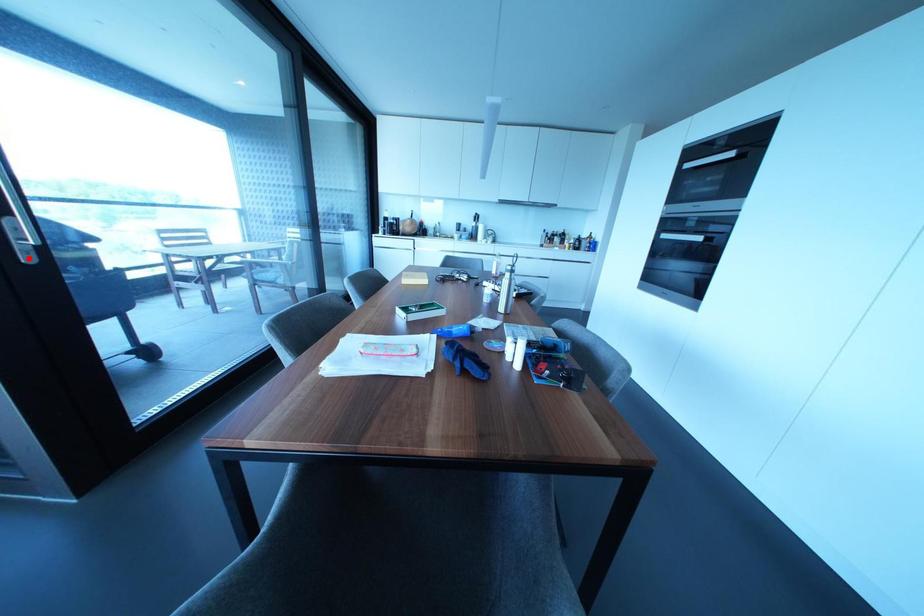
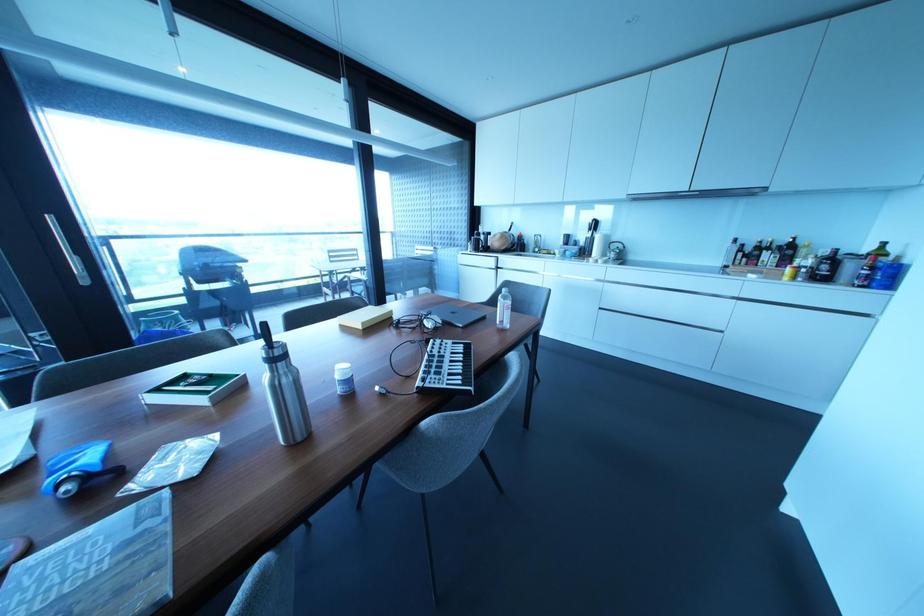
Find the pixel in the second image that matches the highlighted location in the first image.

(83, 281)